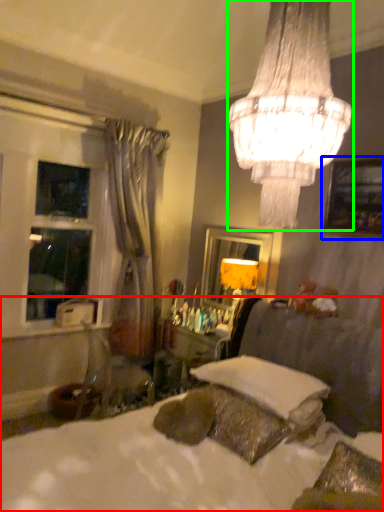
Question: Which is nearer to the bed (highlighted by a red box)? picture frame (highlighted by a blue box) or lamp (highlighted by a green box).

Choices:
 (A) picture frame
 (B) lamp

Answer: (A)